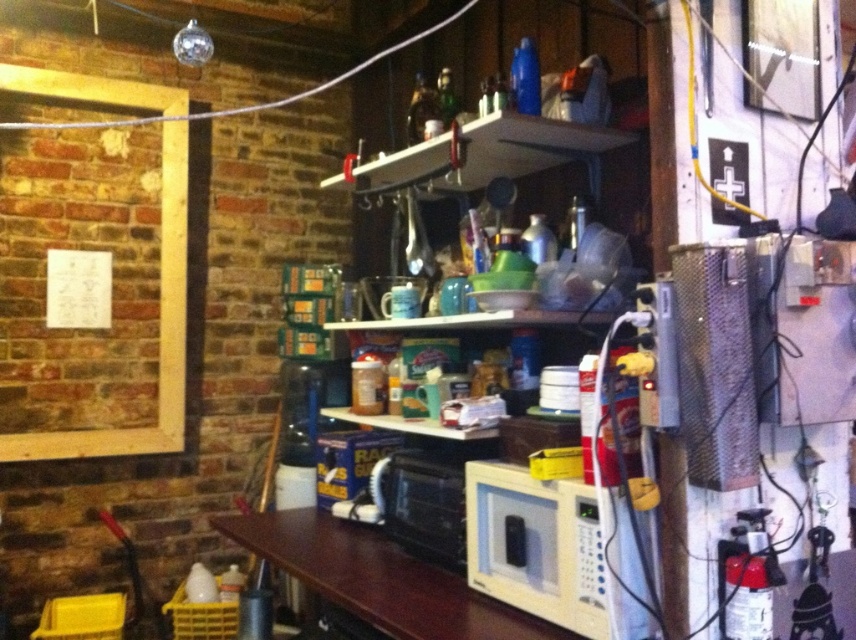
Question: Considering the relative positions of brown wood table at center and white plastic microwave at center in the image provided, where is brown wood table at center located with respect to white plastic microwave at center?

Choices:
 (A) below
 (B) above

Answer: (A)

Question: Can you confirm if white matte microwave at center is bigger than brown wood table at center?

Choices:
 (A) no
 (B) yes

Answer: (A)

Question: Which is farther from the white plastic microwave at center?

Choices:
 (A) white matte microwave at center
 (B) brown wood table at center

Answer: (A)

Question: Is brown wood table at center smaller than white plastic microwave at center?

Choices:
 (A) yes
 (B) no

Answer: (B)

Question: Which point appears closest to the camera in this image?

Choices:
 (A) (428, 616)
 (B) (598, 605)

Answer: (B)

Question: Estimate the real-world distances between objects in this image. Which object is farther from the white matte microwave at center?

Choices:
 (A) brown wood table at center
 (B) white plastic microwave at center

Answer: (B)